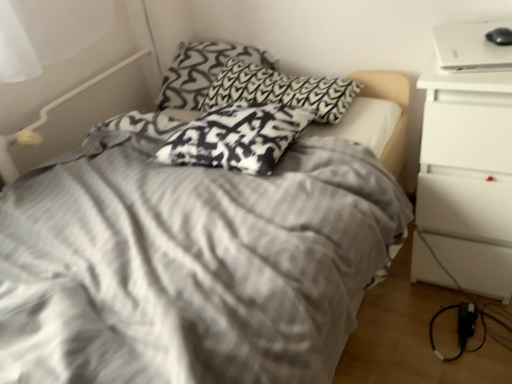
Question: Is white glossy laptop at upper right positioned with its back to gray striped bed at center?

Choices:
 (A) no
 (B) yes

Answer: (A)

Question: Can you confirm if white glossy laptop at upper right is positioned to the right of gray striped bed at center?

Choices:
 (A) yes
 (B) no

Answer: (A)

Question: Does white glossy laptop at upper right come in front of gray striped bed at center?

Choices:
 (A) yes
 (B) no

Answer: (B)

Question: Is white glossy laptop at upper right surrounding gray striped bed at center?

Choices:
 (A) yes
 (B) no

Answer: (B)

Question: Is white glossy laptop at upper right taller than gray striped bed at center?

Choices:
 (A) yes
 (B) no

Answer: (B)

Question: Considering the relative sizes of white glossy laptop at upper right and gray striped bed at center in the image provided, is white glossy laptop at upper right thinner than gray striped bed at center?

Choices:
 (A) yes
 (B) no

Answer: (A)

Question: From the image's perspective, is black and white patterned pillow at upper center, the third pillow from the front, located beneath white glossy laptop at upper right?

Choices:
 (A) yes
 (B) no

Answer: (B)

Question: Is black and white patterned pillow at upper center, the third pillow from the front, looking in the opposite direction of white glossy laptop at upper right?

Choices:
 (A) yes
 (B) no

Answer: (B)

Question: Is black and white patterned pillow at upper center, the third pillow from the front, located outside white glossy laptop at upper right?

Choices:
 (A) no
 (B) yes

Answer: (B)

Question: Can you confirm if black and white patterned pillow at upper center, the third pillow from the front, is taller than white glossy laptop at upper right?

Choices:
 (A) no
 (B) yes

Answer: (B)

Question: Is black and white patterned pillow at upper center, the third pillow from the front, facing towards white glossy laptop at upper right?

Choices:
 (A) yes
 (B) no

Answer: (A)

Question: Does black and white patterned pillow at upper center, the third pillow from the front, have a lesser width compared to white glossy laptop at upper right?

Choices:
 (A) yes
 (B) no

Answer: (B)

Question: Is black and white patterned pillow at upper center, the third pillow from the front, smaller than black plastic power adapter at lower right?

Choices:
 (A) no
 (B) yes

Answer: (A)